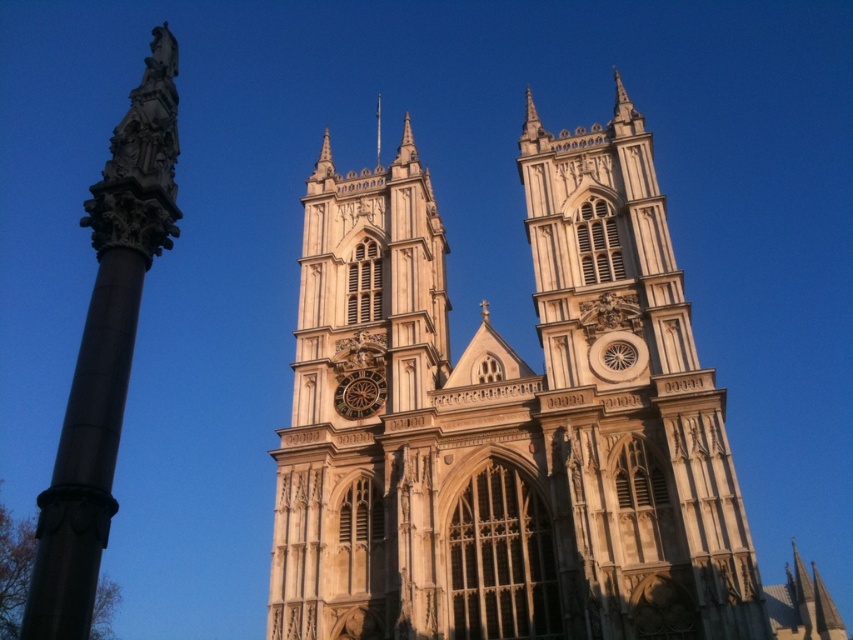
You are standing in front of the cathedral and notice a point marked at coordinates [105,349]. Based on the scene description, can you identify what this point is located on?

The point at [105,349] is located on the polished stone column at left.

You are standing in front of the cathedral and want to take a photo of the golden stone clock at center without the beige stone church at center blocking it. Is this possible?

The beige stone church at center is in front of the golden stone clock at center, so taking a photo of the golden stone clock at center without the beige stone church at center blocking it would not be possible as the church is directly in front of the clock.

You are standing in front of the cathedral and want to take a photo that includes both the beige stone church at center and the white stone spire at upper center. Based on their positions, which object should you position on the left side of your camera frame?

The white stone spire at upper center should be positioned on the left side of your camera frame because the beige stone church at center is to the right of it.